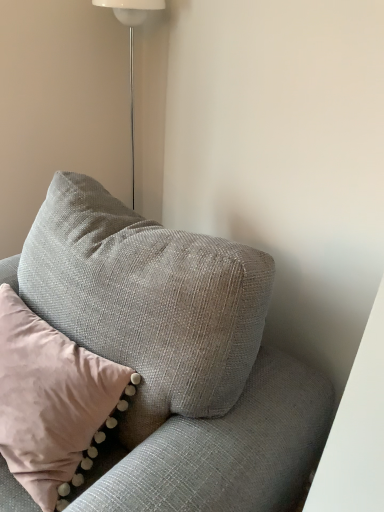
What is the approximate height of textured gray couch at upper right?

The height of textured gray couch at upper right is 33.43 inches.

Measure the distance between textured gray pillow at upper left and camera.

textured gray pillow at upper left and camera are 31.77 inches apart from each other.

Measure the distance between white glossy floor lamp at upper center and camera.

white glossy floor lamp at upper center and camera are 1.30 meters apart from each other.

This screenshot has width=384, height=512. I want to click on textured gray couch at upper right, so click(223, 451).

Does textured gray couch at upper right come behind white glossy floor lamp at upper center?

No, it is in front of white glossy floor lamp at upper center.

From a real-world perspective, is textured gray couch at upper right on white glossy floor lamp at upper center?

No, from a real-world perspective, textured gray couch at upper right is not on top of white glossy floor lamp at upper center.

Is textured gray couch at upper right looking in the opposite direction of white glossy floor lamp at upper center?

No, textured gray couch at upper right is not facing the opposite direction of white glossy floor lamp at upper center.

Is point (47, 374) farther from viewer compared to point (132, 451)?

Yes, it is behind point (132, 451).

In the scene shown: Which of these two, textured gray pillow at upper left or textured gray couch at upper right, is bigger?

textured gray couch at upper right is bigger.

Can you tell me how much textured gray pillow at upper left and textured gray couch at upper right differ in facing direction?

The angle between the facing direction of textured gray pillow at upper left and the facing direction of textured gray couch at upper right is 1.28 degrees.

Is textured gray pillow at upper left completely or partially outside of textured gray couch at upper right?

No, textured gray pillow at upper left is inside textured gray couch at upper right's boundary.

Could you tell me if white glossy floor lamp at upper center is turned towards textured gray couch at upper right?

No.

Can you tell me how much white glossy floor lamp at upper center and textured gray couch at upper right differ in facing direction?

The facing directions of white glossy floor lamp at upper center and textured gray couch at upper right are 18.2 degrees apart.

Where is `couch on the left of white glossy floor lamp at upper center`? The image size is (384, 512). couch on the left of white glossy floor lamp at upper center is located at coordinates pyautogui.click(x=223, y=451).

Considering the relative sizes of white glossy floor lamp at upper center and textured gray couch at upper right in the image provided, is white glossy floor lamp at upper center thinner than textured gray couch at upper right?

Yes, white glossy floor lamp at upper center is thinner than textured gray couch at upper right.

Is point (23, 423) farther from viewer compared to point (132, 178)?

No, it is not.

Is textured gray pillow at upper left smaller than white glossy floor lamp at upper center?

Actually, textured gray pillow at upper left might be larger than white glossy floor lamp at upper center.

Between textured gray pillow at upper left and white glossy floor lamp at upper center, which one has smaller width?

white glossy floor lamp at upper center.

Looking at this image, are textured gray pillow at upper left and white glossy floor lamp at upper center far apart?

Yes, textured gray pillow at upper left and white glossy floor lamp at upper center are quite far apart.

Between point (257, 372) and point (5, 444), which one is positioned behind?

Positioned behind is point (257, 372).

From a real-world perspective, which object rests below the other?

textured gray couch at upper right.

Could you tell me if textured gray couch at upper right is turned towards textured gray pillow at upper left?

Yes.

Looking at this image, how much distance is there between textured gray couch at upper right and textured gray pillow at upper left?

textured gray couch at upper right and textured gray pillow at upper left are 19.74 centimeters apart.

Considering the sizes of objects white glossy floor lamp at upper center and textured gray pillow at upper left in the image provided, who is wider, white glossy floor lamp at upper center or textured gray pillow at upper left?

With larger width is textured gray pillow at upper left.

Which is closer, (130, 10) or (75, 372)?

Positioned in front is point (75, 372).

I want to click on couch that appears in front of the white glossy floor lamp at upper center, so click(223, 451).

Where is `couch on the right side of textured gray pillow at upper left`? couch on the right side of textured gray pillow at upper left is located at coordinates (223, 451).

Which object lies nearer to the anchor point textured gray couch at upper right, textured gray pillow at upper left or white glossy floor lamp at upper center?

textured gray pillow at upper left is closer to textured gray couch at upper right.

Considering their positions, is textured gray couch at upper right positioned further to white glossy floor lamp at upper center than textured gray pillow at upper left?

The object further to white glossy floor lamp at upper center is textured gray couch at upper right.

When comparing their distances from textured gray couch at upper right, does white glossy floor lamp at upper center or textured gray pillow at upper left seem further?

white glossy floor lamp at upper center is positioned further to the anchor textured gray couch at upper right.

In the scene shown: Considering their positions, is white glossy floor lamp at upper center positioned further to textured gray pillow at upper left than textured gray couch at upper right?

The object further to textured gray pillow at upper left is white glossy floor lamp at upper center.

Based on their spatial positions, is textured gray couch at upper right or white glossy floor lamp at upper center closer to textured gray pillow at upper left?

textured gray couch at upper right.

Based on their spatial positions, is textured gray pillow at upper left or textured gray couch at upper right further from white glossy floor lamp at upper center?

The object further to white glossy floor lamp at upper center is textured gray couch at upper right.

The width and height of the screenshot is (384, 512). Find the location of `pillow between white glossy floor lamp at upper center and textured gray couch at upper right vertically`. pillow between white glossy floor lamp at upper center and textured gray couch at upper right vertically is located at coordinates (49, 399).